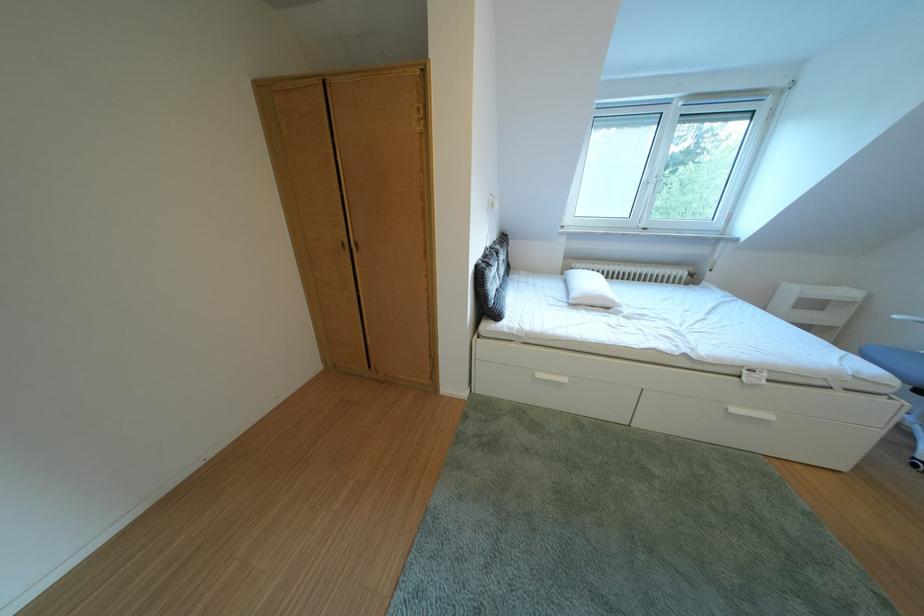
Which object does [589,289] point to?

This point indicates the white pillow.